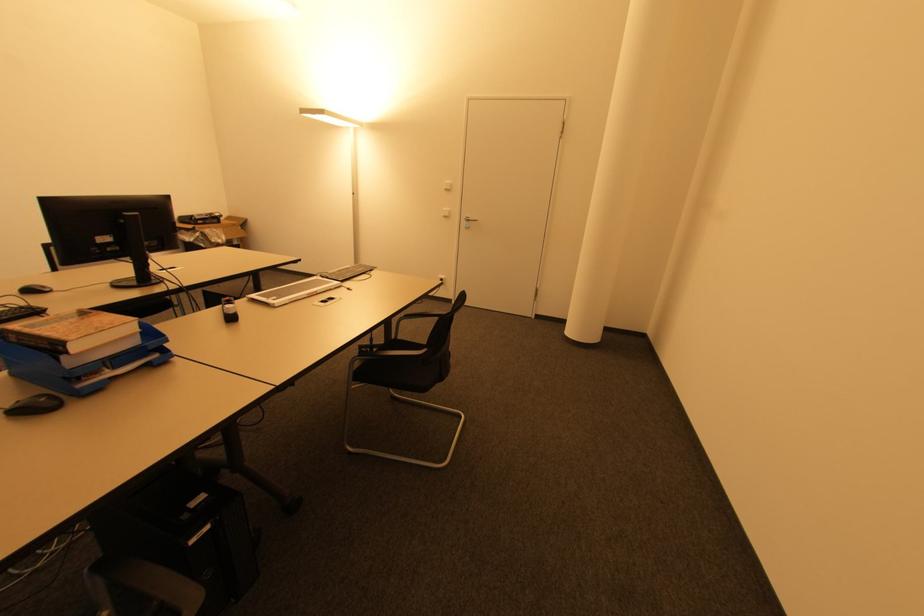
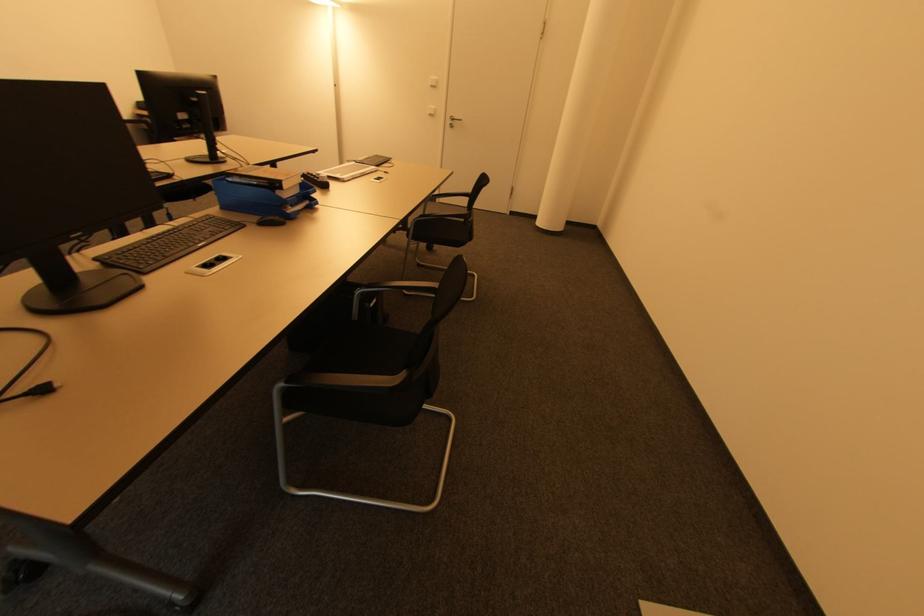
In the second image, find the point that corresponds to [116,368] in the first image.

(294, 207)